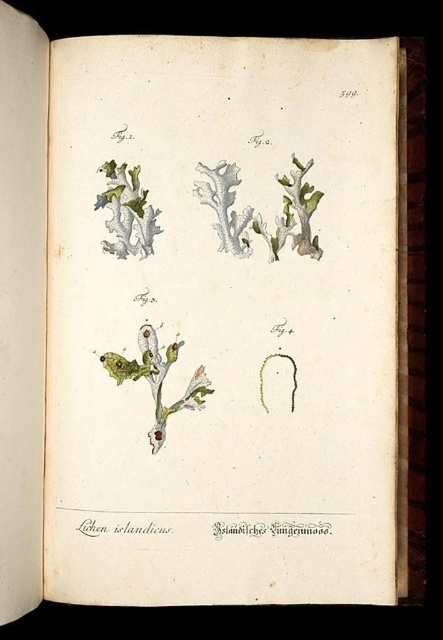
Question: Observing the image, what is the correct spatial positioning of greenish-white lichen at upper left in reference to green matte lichen at center?

Choices:
 (A) above
 (B) below

Answer: (A)

Question: Is greenish-white lichen at upper left below green matte lichen at center?

Choices:
 (A) no
 (B) yes

Answer: (A)

Question: Does greenish-white lichen at upper left have a lesser width compared to green matte lichen at center?

Choices:
 (A) no
 (B) yes

Answer: (A)

Question: Which of the following is the closest to the observer?

Choices:
 (A) greenish-white lichen at upper left
 (B) green matte lichen at center

Answer: (A)

Question: Which object is farther from the camera taking this photo?

Choices:
 (A) greenish-white lichen at upper left
 (B) green matte lichen at center

Answer: (B)